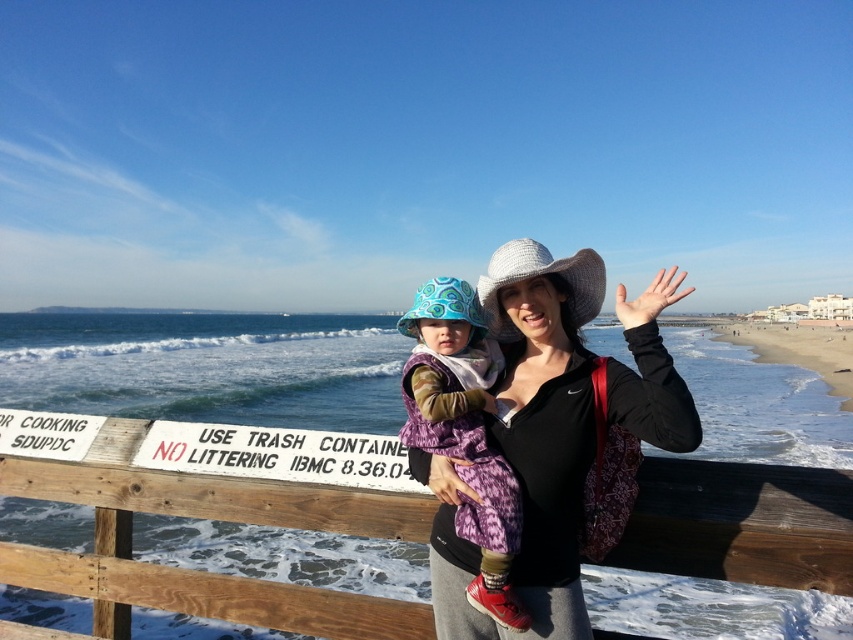
Question: Which object is positioned closest to the patterned fabric baby carrier at center?

Choices:
 (A) wooden at center
 (B) matte black jacket at center
 (C) white painted wood sign at lower center

Answer: (B)

Question: Among these objects, which one is farthest from the camera?

Choices:
 (A) white painted wood sign at lower center
 (B) wooden at center
 (C) matte black jacket at center

Answer: (A)

Question: Can you confirm if wooden at center is bigger than matte black jacket at center?

Choices:
 (A) yes
 (B) no

Answer: (A)

Question: Does wooden at center appear over matte black jacket at center?

Choices:
 (A) yes
 (B) no

Answer: (B)

Question: Does wooden at center have a lesser width compared to white painted wood sign at lower center?

Choices:
 (A) no
 (B) yes

Answer: (A)

Question: Among these objects, which one is nearest to the camera?

Choices:
 (A) wooden at center
 (B) matte black jacket at center
 (C) white painted wood sign at lower center

Answer: (B)